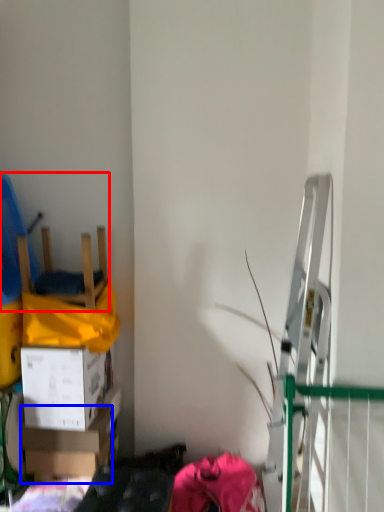
Question: Which object is further to the camera taking this photo, chair (highlighted by a red box) or box (highlighted by a blue box)?

Choices:
 (A) chair
 (B) box

Answer: (B)